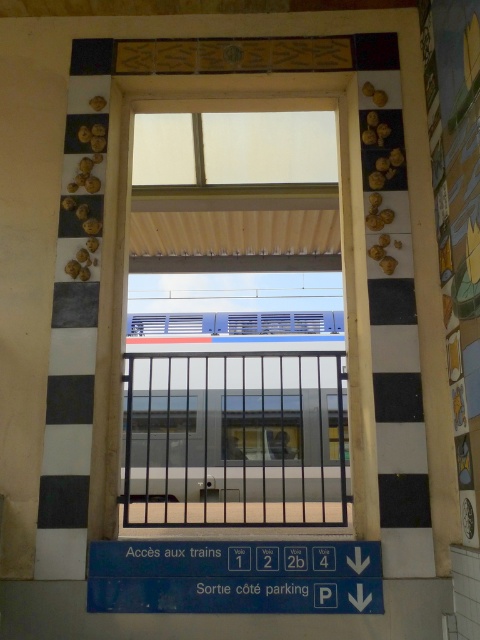
Between point (211, 436) and point (287, 419), which one is positioned in front?

Point (211, 436) is in front.

Locate an element on the screen. silver metallic rail at center is located at coordinates (235, 440).

Is white glass window at upper center positioned in front of transparent glass train at center?

Yes, white glass window at upper center is in front of transparent glass train at center.

Which is more to the right, white glass window at upper center or transparent glass train at center?

From the viewer's perspective, transparent glass train at center appears more on the right side.

Describe the element at coordinates (233, 147) in the screenshot. This screenshot has height=640, width=480. I see `white glass window at upper center` at that location.

Image resolution: width=480 pixels, height=640 pixels. I want to click on white glass window at upper center, so click(x=233, y=147).

Does silver metallic rail at center lie in front of white glass window at upper center?

No, silver metallic rail at center is further to the viewer.

Is silver metallic rail at center bigger than white glass window at upper center?

Correct, silver metallic rail at center is larger in size than white glass window at upper center.

You are a GUI agent. You are given a task and a screenshot of the screen. Output one action in this format:
    pyautogui.click(x=<x>, y=<y>)
    Task: Click on the silver metallic rail at center
    
    Given the screenshot: What is the action you would take?
    pyautogui.click(x=235, y=440)

Where is `silver metallic rail at center`? The image size is (480, 640). silver metallic rail at center is located at coordinates point(235,440).